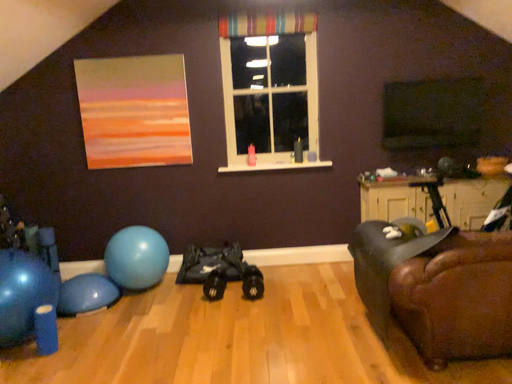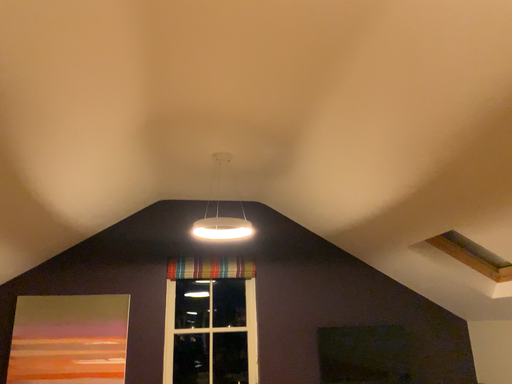
Question: How did the camera likely rotate when shooting the video?

Choices:
 (A) rotated upward
 (B) rotated downward

Answer: (A)